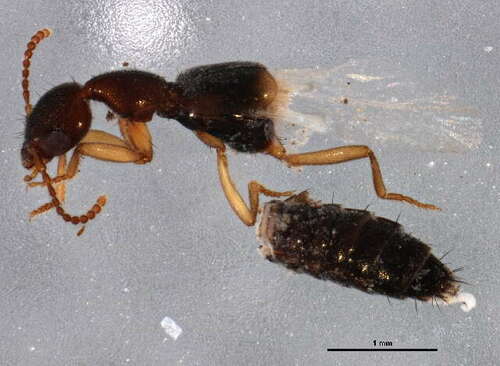
Find the location of a particular element. This screenshot has height=366, width=500. light reflections is located at coordinates (78, 125), (141, 103), (190, 111), (235, 116).